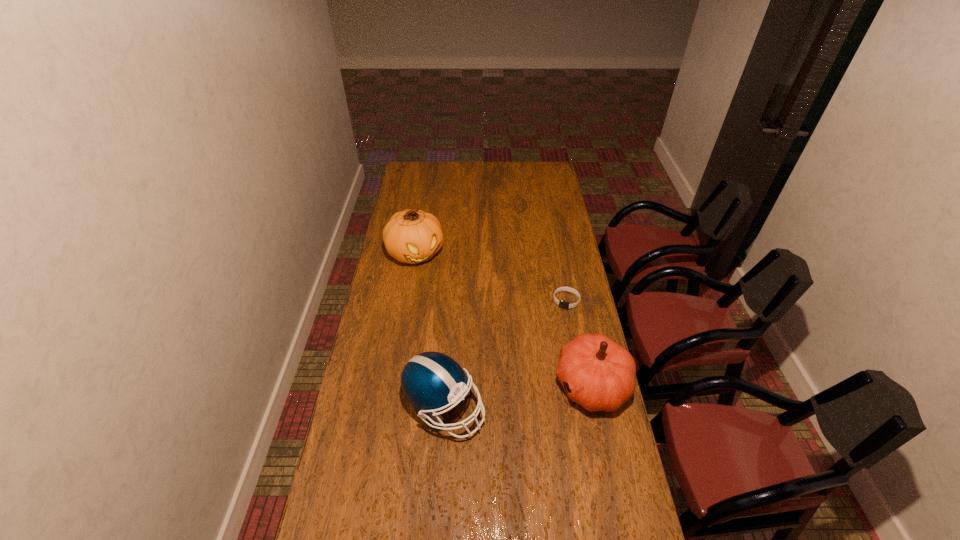
What are the coordinates of `free space at the near edge of the desktop` in the screenshot? It's located at (383, 504).

You are a GUI agent. You are given a task and a screenshot of the screen. Output one action in this format:
    pyautogui.click(x=<x>, y=<y>)
    Task: Click on the vacant position at the left edge of the desktop
    The width and height of the screenshot is (960, 540).
    Given the screenshot: What is the action you would take?
    369,342

In the image, there is a desktop. At what (x,y) coordinates should I click in order to perform the action: click on free region at the right edge. Please return your answer as a coordinate pair (x, y). This screenshot has width=960, height=540. Looking at the image, I should click on (548, 244).

Locate an element on the screen. blank space at the far right corner of the desktop is located at coordinates (532, 176).

You are a GUI agent. You are given a task and a screenshot of the screen. Output one action in this format:
    pyautogui.click(x=<x>, y=<y>)
    Task: Click on the free space between the farther pumpkin and the shortest object
    
    Given the screenshot: What is the action you would take?
    pyautogui.click(x=491, y=277)

I want to click on empty space that is in between the farther pumpkin and the football helmet, so click(430, 330).

Image resolution: width=960 pixels, height=540 pixels. Find the location of `empty space that is in between the farthest object and the football helmet`. empty space that is in between the farthest object and the football helmet is located at coordinates (430, 330).

Where is `unoccupied position between the left pumpkin and the football helmet`? unoccupied position between the left pumpkin and the football helmet is located at coordinates (430, 330).

You are a GUI agent. You are given a task and a screenshot of the screen. Output one action in this format:
    pyautogui.click(x=<x>, y=<y>)
    Task: Click on the free space that is in between the football helmet and the wristband
    This screenshot has width=960, height=540.
    Given the screenshot: What is the action you would take?
    pyautogui.click(x=505, y=354)

This screenshot has width=960, height=540. What are the coordinates of `empty space between the shortest object and the farther pumpkin` in the screenshot? It's located at (491, 277).